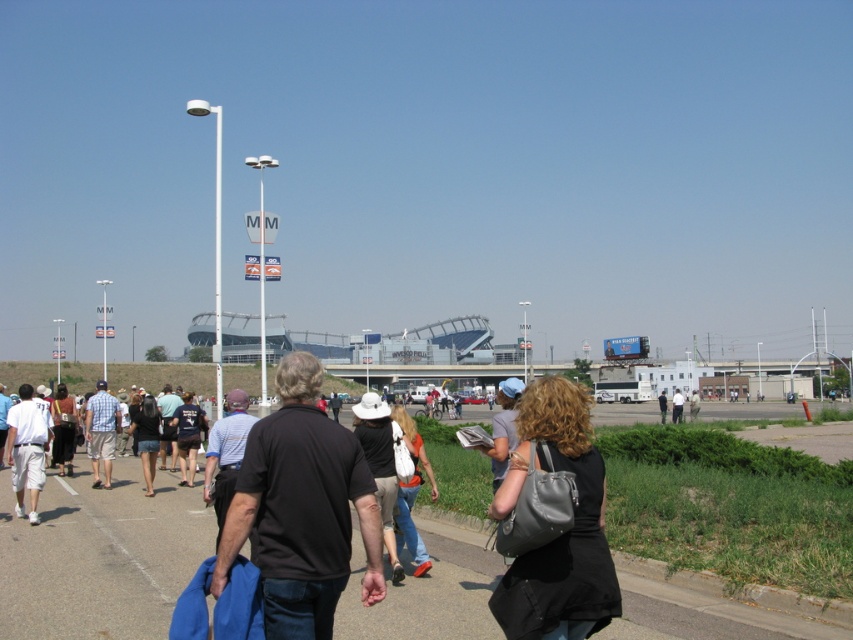
Question: Estimate the real-world distances between objects in this image. Which object is closer to the smooth asphalt tarmac at center?

Choices:
 (A) denim jeans at center
 (B) matte black bag at lower right
 (C) white cotton shorts at left

Answer: (C)

Question: Can you confirm if black cotton shirt at center is positioned to the left of denim jeans at center?

Choices:
 (A) no
 (B) yes

Answer: (B)

Question: Does white cotton shorts at left come in front of denim jeans at center?

Choices:
 (A) no
 (B) yes

Answer: (A)

Question: Which object appears farthest from the camera in this image?

Choices:
 (A) black cotton shirt at center
 (B) matte black bag at lower right

Answer: (B)

Question: Which point appears farthest from the camera in this image?

Choices:
 (A) (41, 432)
 (B) (245, 476)

Answer: (A)

Question: Can you confirm if smooth asphalt tarmac at center is thinner than matte black bag at lower right?

Choices:
 (A) yes
 (B) no

Answer: (B)